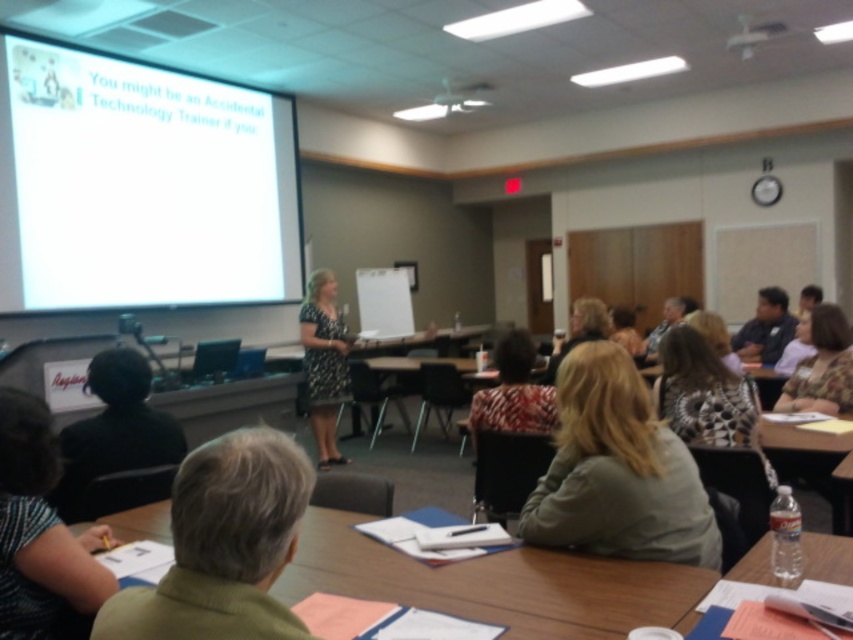
Question: Based on their relative distances, which object is nearer to the wooden table at center?

Choices:
 (A) patterned fabric blouse at lower right
 (B) white matte projection screen at upper left
 (C) clear plastic bottle at lower right

Answer: (B)

Question: Does white matte projection screen at upper left come in front of black dotted dress at center?

Choices:
 (A) yes
 (B) no

Answer: (A)

Question: Can you confirm if clear plastic bottle at lower right is positioned to the right of wooden table at center?

Choices:
 (A) yes
 (B) no

Answer: (A)

Question: Can you confirm if black dotted dress at center is positioned above blonde hair at center?

Choices:
 (A) no
 (B) yes

Answer: (A)

Question: Which object appears farthest from the camera in this image?

Choices:
 (A) black dotted dress at center
 (B) white matte projection screen at upper left
 (C) patterned fabric blouse at lower right

Answer: (A)

Question: Which of these objects is positioned closest to the patterned fabric blouse at lower right?

Choices:
 (A) green fabric table at lower center
 (B) white matte projection screen at upper left
 (C) blonde hair at center
 (D) wooden table at center

Answer: (C)